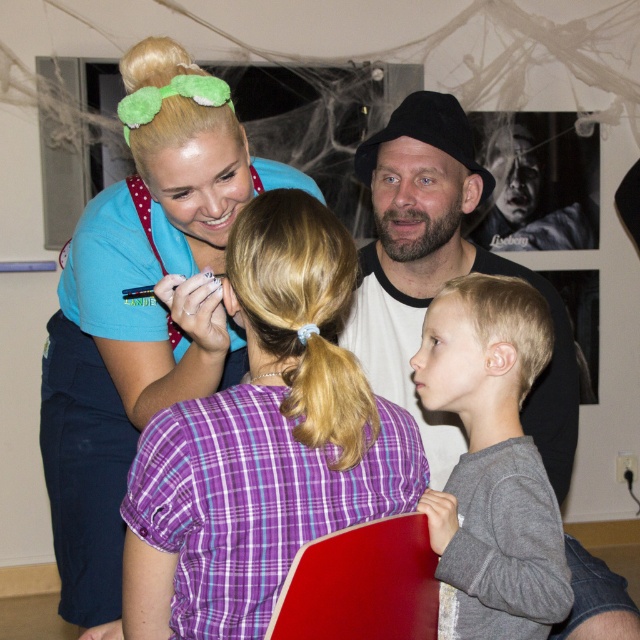
Question: Which object is the farthest from the purple plaid shirt at center?

Choices:
 (A) blue scrubs at upper left
 (B) blonde smooth hair at lower right
 (C) black cotton hat at upper center

Answer: (C)

Question: Is blue scrubs at upper left bigger than gray cotton shirt at right?

Choices:
 (A) yes
 (B) no

Answer: (A)

Question: Does purple plaid shirt at center appear over black cotton hat at upper center?

Choices:
 (A) yes
 (B) no

Answer: (B)

Question: Which object appears farthest from the camera in this image?

Choices:
 (A) black cotton hat at upper center
 (B) green fuzzy headband at upper left

Answer: (A)

Question: Which object is positioned closest to the gray cotton shirt at right?

Choices:
 (A) green fuzzy headband at upper left
 (B) purple plaid shirt at center

Answer: (B)

Question: Does purple plaid shirt at center come in front of blonde smooth hair at lower right?

Choices:
 (A) no
 (B) yes

Answer: (B)